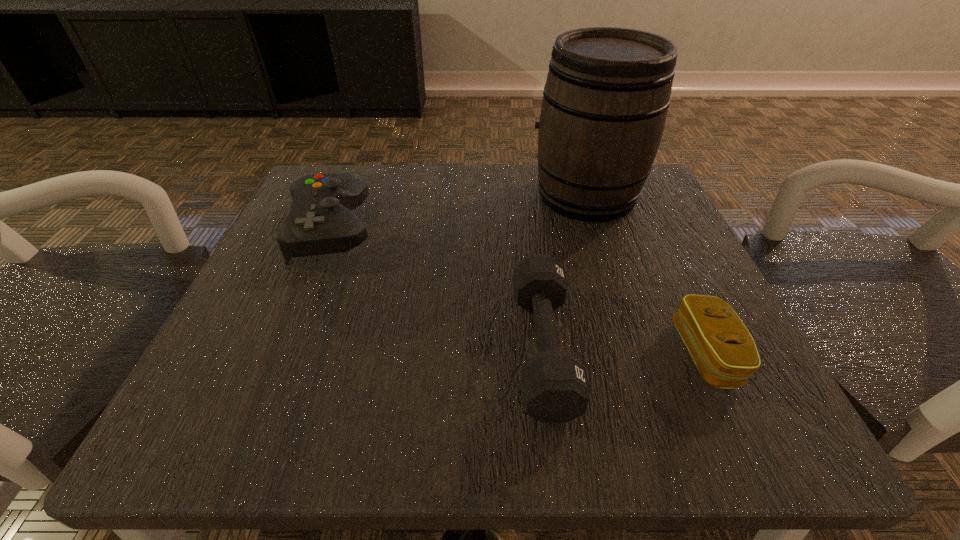
In order to click on wine bucket in this screenshot , I will do `click(605, 101)`.

I want to click on control, so click(320, 221).

Image resolution: width=960 pixels, height=540 pixels. Identify the location of dumbbell. (555, 388).

At what (x,y) coordinates should I click in order to perform the action: click on the shortest object. Please return your answer as a coordinate pair (x, y). The image size is (960, 540). Looking at the image, I should click on (725, 354).

Find the location of a particular element. The image size is (960, 540). free space located on the front of the tallest object is located at coordinates (624, 318).

At what (x,y) coordinates should I click in order to perform the action: click on vacant space located 0.300m on the right of the control. Please return your answer as a coordinate pair (x, y). The height and width of the screenshot is (540, 960). Looking at the image, I should click on (536, 230).

Locate an element on the screen. The image size is (960, 540). vacant area located 0.050m on the left of the dumbbell is located at coordinates (481, 348).

The height and width of the screenshot is (540, 960). I want to click on free space located 0.110m on the zipper side of the clutch bag, so click(x=601, y=354).

Find the location of a particular element. This screenshot has height=540, width=960. free space located on the zipper side of the clutch bag is located at coordinates (508, 354).

I want to click on free space located 0.200m on the zipper side of the clutch bag, so point(537,354).